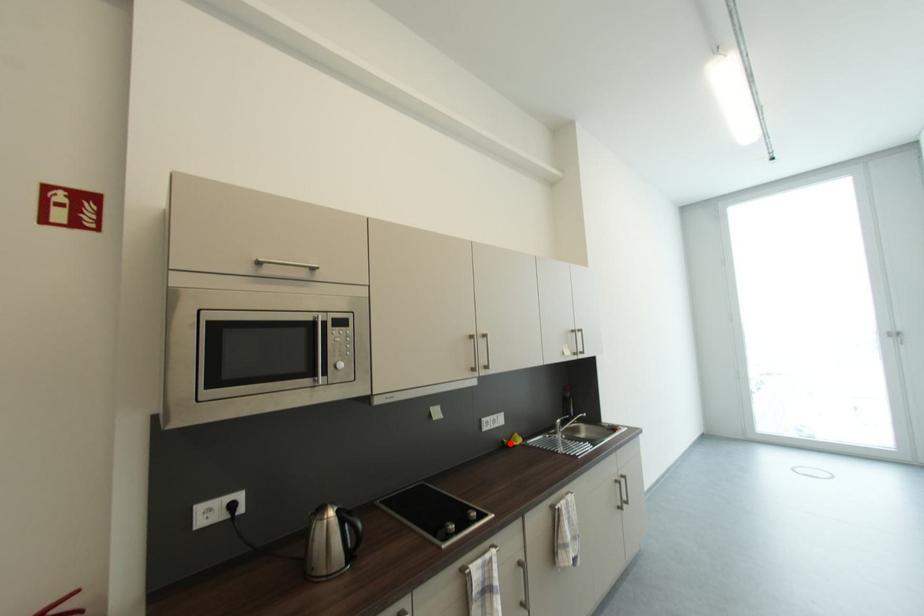
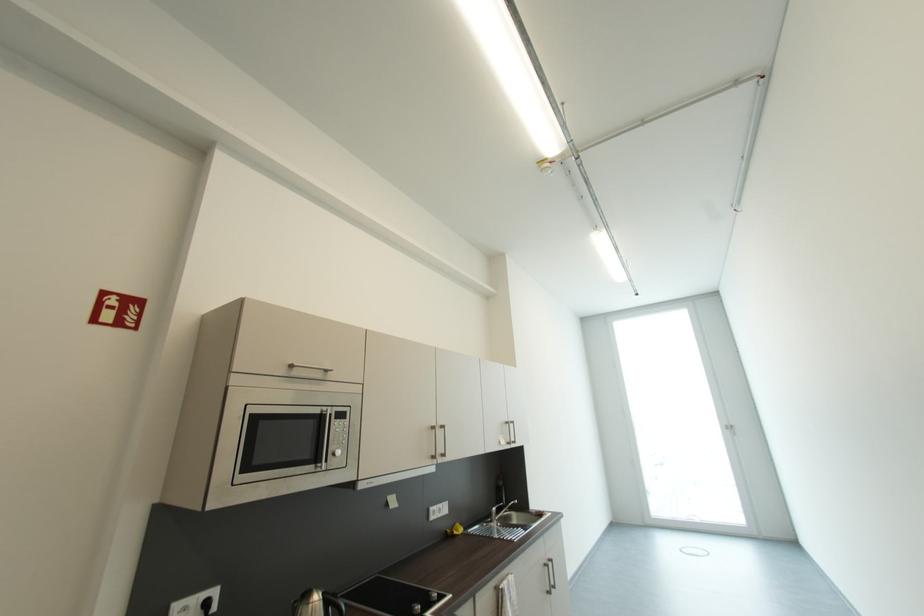
Locate, in the second image, the point that corresponds to the highlighted location in the first image.

(454, 533)